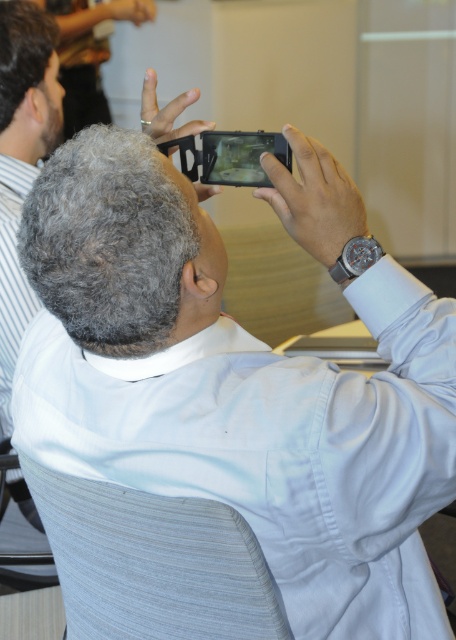
Which is in front, point (253, 625) or point (336, 259)?

Point (253, 625)

At what (x,y) coordinates should I click in order to perform the action: click on light gray woven fabric chair at lower center. Please return your answer as a coordinate pair (x, y). The width and height of the screenshot is (456, 640). Looking at the image, I should click on (154, 563).

Does point (20, 461) come closer to viewer compared to point (373, 252)?

No, (20, 461) is behind (373, 252).

This screenshot has width=456, height=640. I want to click on light gray woven fabric chair at lower center, so click(154, 563).